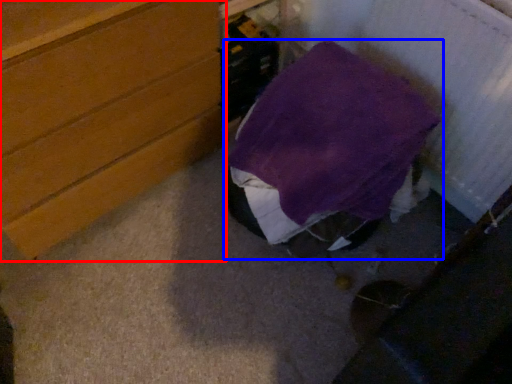
Question: Which of the following is the closest to the observer, chest of drawers (highlighted by a red box) or furniture (highlighted by a blue box)?

Choices:
 (A) chest of drawers
 (B) furniture

Answer: (A)